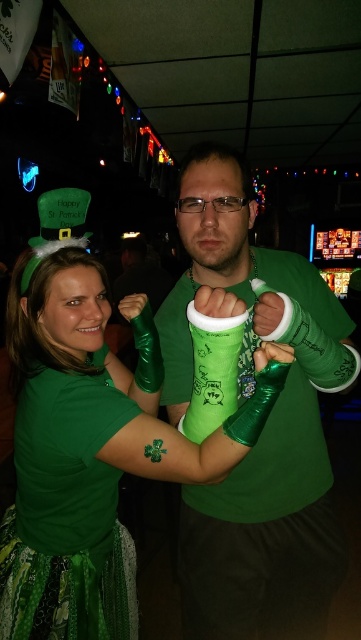
Which of these two, shiny green arm bands at center or green matte t-shirt at left, stands shorter?

With less height is green matte t-shirt at left.

Is shiny green arm bands at center above green matte t-shirt at left?

Yes, shiny green arm bands at center is above green matte t-shirt at left.

Which is behind, point (292, 426) or point (71, 467)?

Point (292, 426)

You are a GUI agent. You are given a task and a screenshot of the screen. Output one action in this format:
    pyautogui.click(x=<x>, y=<y>)
    Task: Click on the shiny green arm bands at center
    
    Given the screenshot: What is the action you would take?
    pyautogui.click(x=264, y=424)

Does matte green shirt at center have a greater height compared to green matte t-shirt at left?

Correct, matte green shirt at center is much taller as green matte t-shirt at left.

Does matte green shirt at center have a greater width compared to green matte t-shirt at left?

Yes.

Where is `matte green shirt at center`? matte green shirt at center is located at coordinates (93, 451).

Does matte green shirt at center have a greater width compared to shiny green arm bands at center?

Indeed, matte green shirt at center has a greater width compared to shiny green arm bands at center.

Between matte green shirt at center and shiny green arm bands at center, which one has more height?

With more height is shiny green arm bands at center.

Is point (76, 422) positioned behind point (222, 212)?

No, (76, 422) is closer to viewer.

The image size is (361, 640). What are the coordinates of `matte green shirt at center` in the screenshot? It's located at (93, 451).